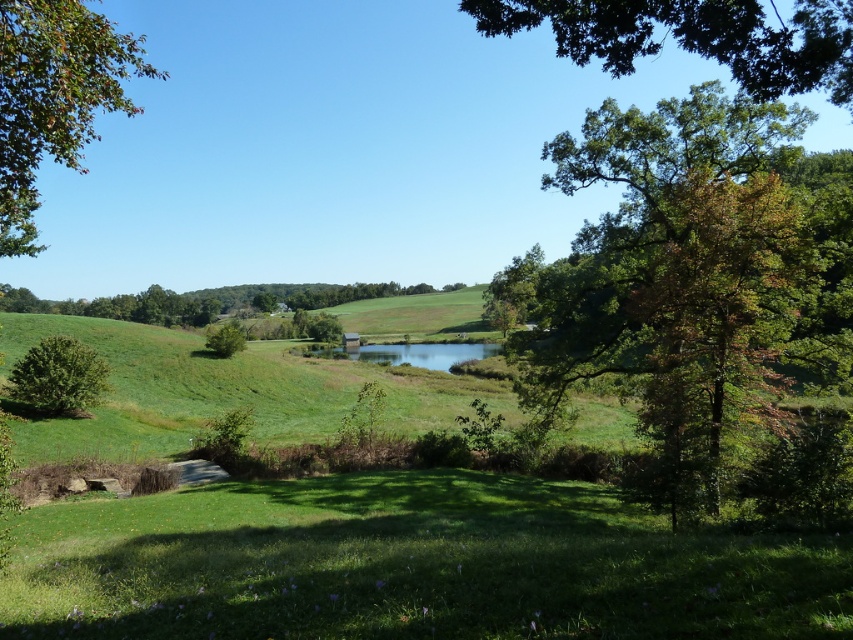
Can you confirm if green leafy tree at upper right is taller than green grassy field at center?

Yes.

This screenshot has height=640, width=853. Describe the element at coordinates (695, 36) in the screenshot. I see `green leafy tree at upper right` at that location.

Locate an element on the screen. green leafy tree at upper right is located at coordinates (695, 36).

Does green leafy tree at right appear on the left side of green leafy tree at upper left?

Incorrect, green leafy tree at right is not on the left side of green leafy tree at upper left.

Who is higher up, green leafy tree at right or green leafy tree at upper left?

green leafy tree at upper left is above.

I want to click on green leafy tree at right, so click(689, 276).

Does green matte tree at lower left appear over green leafy tree at center?

Actually, green matte tree at lower left is below green leafy tree at center.

Which is above, green matte tree at lower left or green leafy tree at center?

green leafy tree at center is above.

What do you see at coordinates (59, 376) in the screenshot?
I see `green matte tree at lower left` at bounding box center [59, 376].

Where is `green matte tree at lower left`? The image size is (853, 640). green matte tree at lower left is located at coordinates (59, 376).